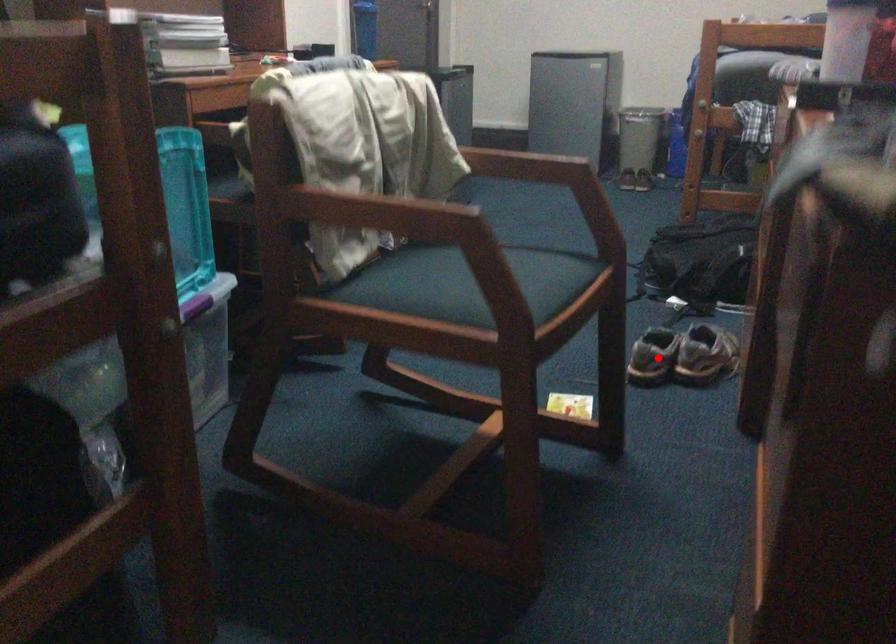
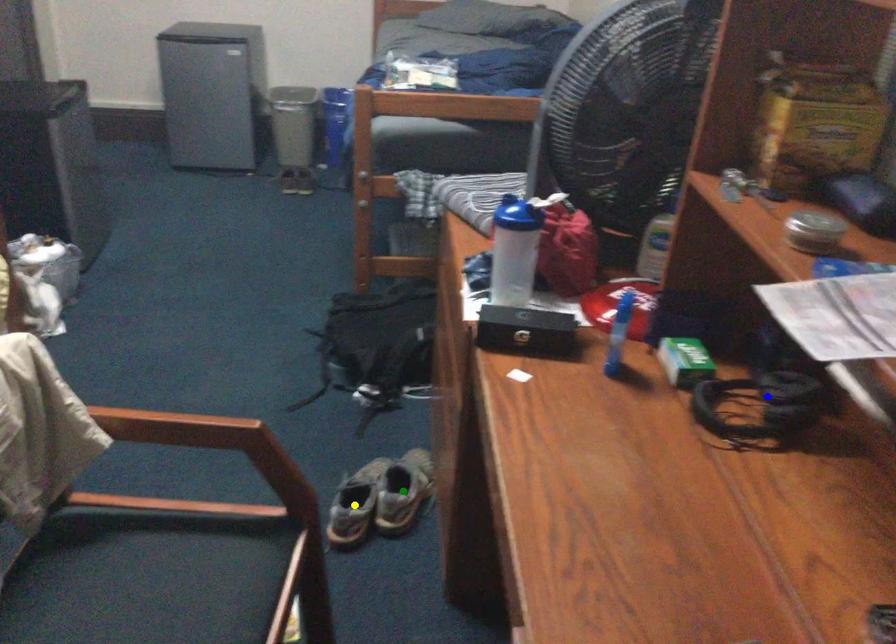
Question: I am providing you with two images of the same scene from different viewpoints. A red point is marked on the first image. You are given multiple points on the second image. Which point in image 2 is actually the same real-world point as the red point in image 1?

Choices:
 (A) green point
 (B) yellow point
 (C) blue point

Answer: (B)